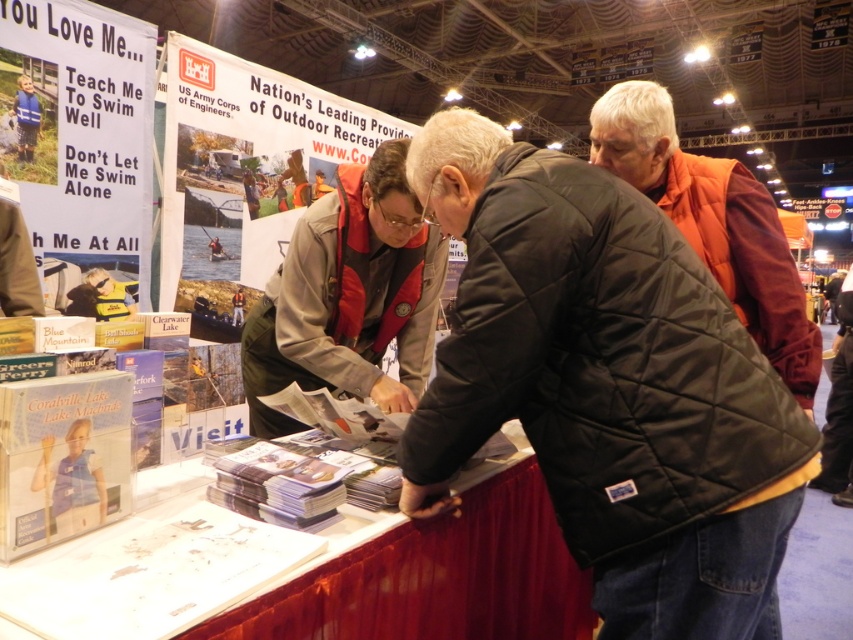
You are a vendor at the trade show and need to display two vests on a mannequin. The mannequin has a torso width of 40 cm. The black quilted vest at center and the orange quilted vest at center are both available. Which vest would you choose to ensure it fits on the mannequin?

The black quilted vest at center is wider than the orange quilted vest at center. Since the mannequin has a torso width of 40 cm, you should choose the orange quilted vest at center to ensure it fits, as it is narrower than the black one.